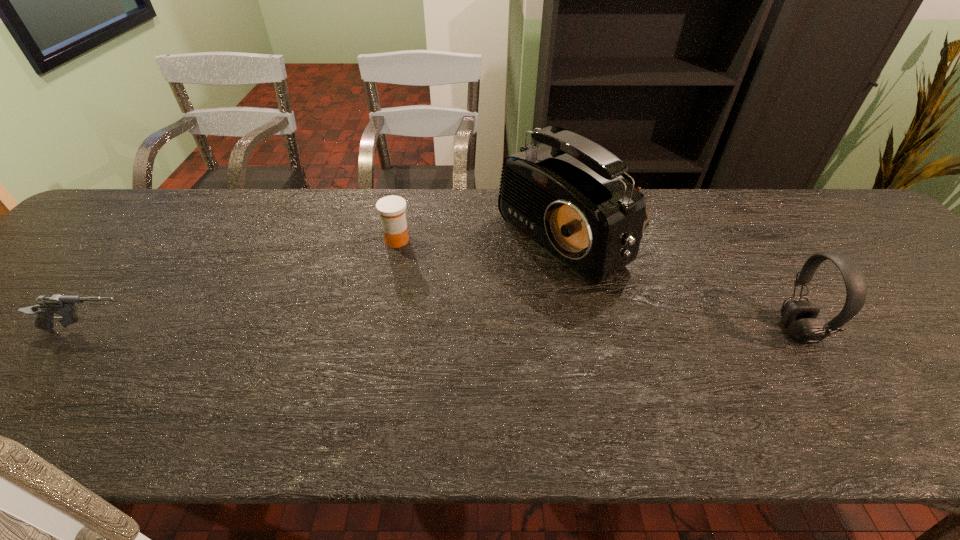
Identify the location of vacant space situated on the front-facing side of the third object from left to right. (484, 287).

You are a GUI agent. You are given a task and a screenshot of the screen. Output one action in this format:
    pyautogui.click(x=<x>, y=<y>)
    Task: Click on the vacant space located 0.120m on the label of the second object from left to right
    
    Given the screenshot: What is the action you would take?
    pyautogui.click(x=389, y=281)

I want to click on vacant space located 0.320m on the label of the second object from left to right, so click(x=376, y=346).

Where is `vacant point located on the label of the second object from left to right`? This screenshot has width=960, height=540. vacant point located on the label of the second object from left to right is located at coordinates (382, 318).

Locate an element on the screen. radio receiver that is at the far edge is located at coordinates (566, 195).

Identify the location of medicine located in the far edge section of the desktop. (392, 208).

I want to click on object that is at the near edge, so click(x=799, y=317).

This screenshot has height=540, width=960. Identify the location of object positioned at the left edge. (47, 306).

Image resolution: width=960 pixels, height=540 pixels. Find the location of `vacant space at the far edge`. vacant space at the far edge is located at coordinates (431, 217).

Find the location of `vacant position at the near edge of the desktop`. vacant position at the near edge of the desktop is located at coordinates (936, 383).